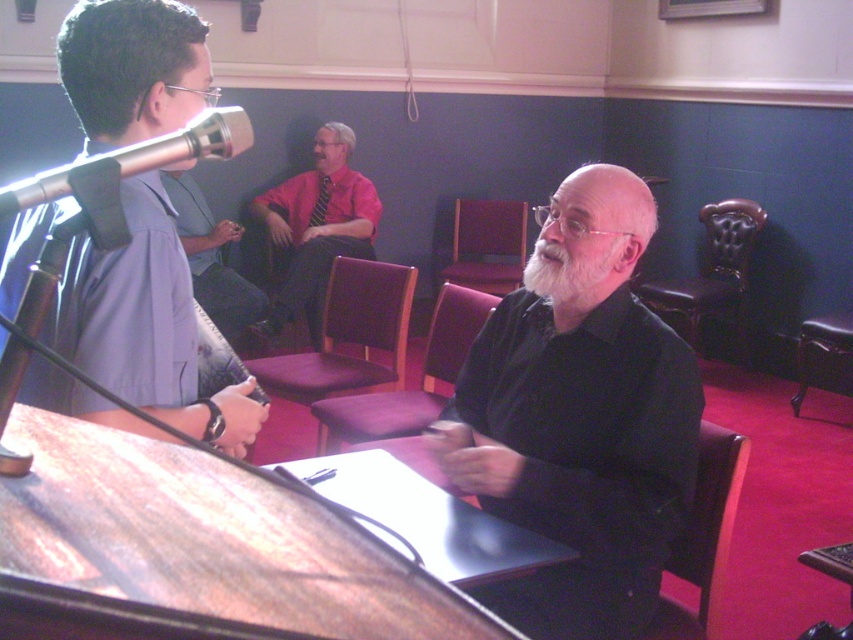
Question: Does wooden table at center have a smaller size compared to leather tufted armchair at right?

Choices:
 (A) no
 (B) yes

Answer: (B)

Question: Based on their relative distances, which object is farther from the black leather armchair at right?

Choices:
 (A) purple fabric chair at center
 (B) wooden armchair at center
 (C) matte red shirt at center

Answer: (C)

Question: Which point appears closest to the camera in this image?

Choices:
 (A) (294, 371)
 (B) (730, 477)

Answer: (B)

Question: Is silver metallic microphone at upper left thinner than white fuzzy beard at center?

Choices:
 (A) yes
 (B) no

Answer: (B)

Question: Can you confirm if purple fabric chair at center is positioned to the right of wooden armchair at center?

Choices:
 (A) no
 (B) yes

Answer: (A)

Question: Estimate the real-world distances between objects in this image. Which object is closer to the leather tufted armchair at right?

Choices:
 (A) black leather armchair at right
 (B) matte red shirt at center
 (C) wooden armchair at center

Answer: (A)